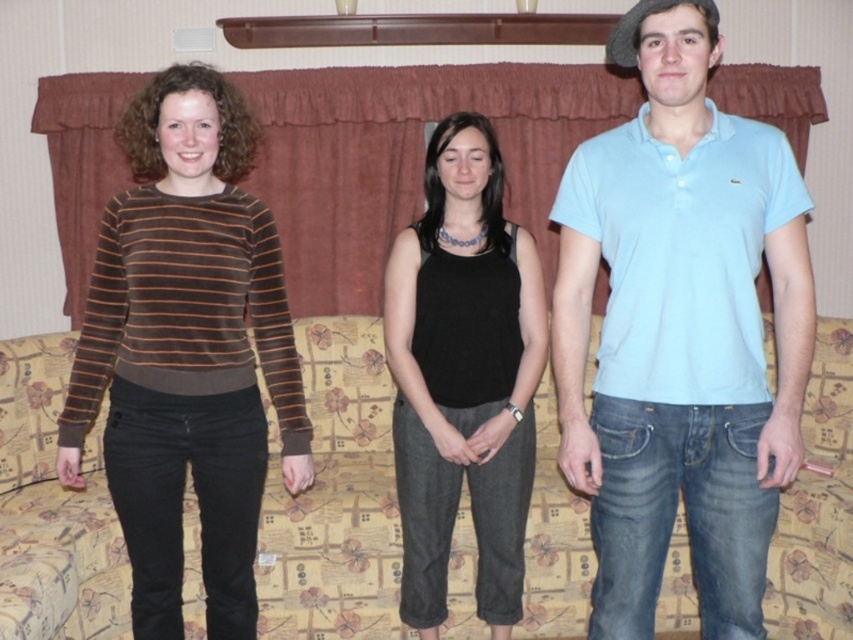
You are a photographer setting up a shoot in this room. You need to ensure that the light blue cotton polo shirt at right and the black matte tank top at center are visible in the frame. Given their height differences, which clothing item might require you to adjust your camera angle to capture both properly?

The light blue cotton polo shirt at right is shorter than the black matte tank top at center, so you might need to lower the camera angle slightly to ensure the shorter light blue cotton polo shirt at right is fully visible while still capturing the taller black matte tank top at center.